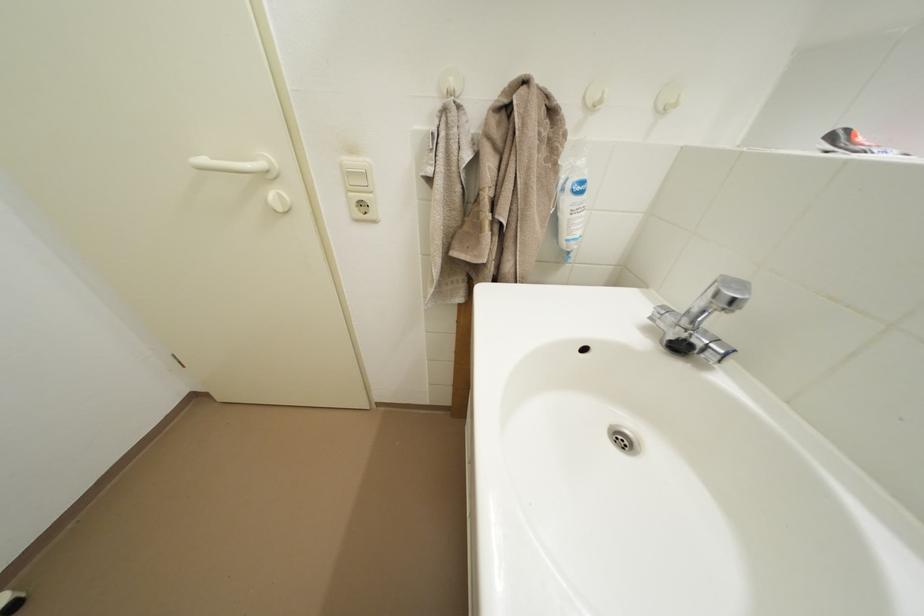
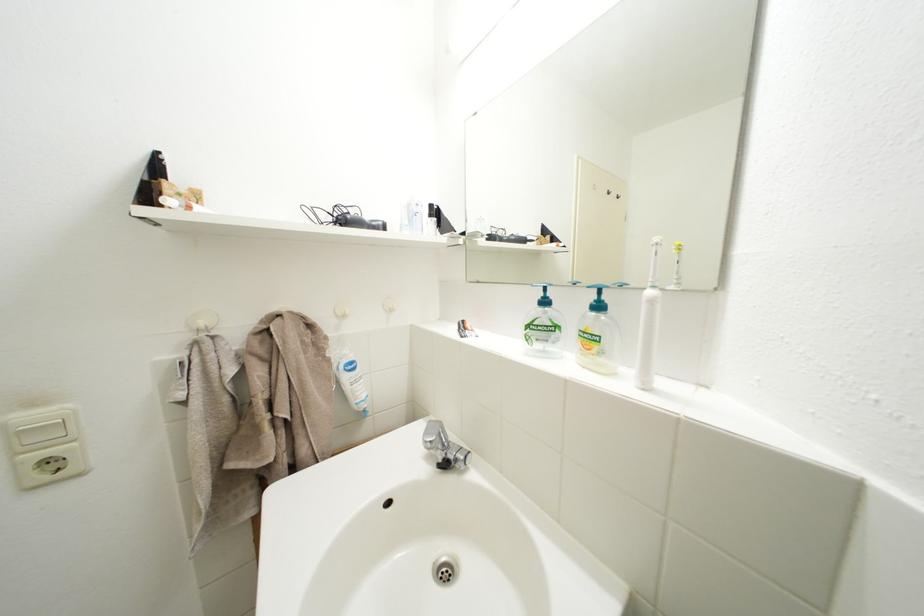
Find the pixel in the second image that matches point 460,89 in the first image.

(211, 329)